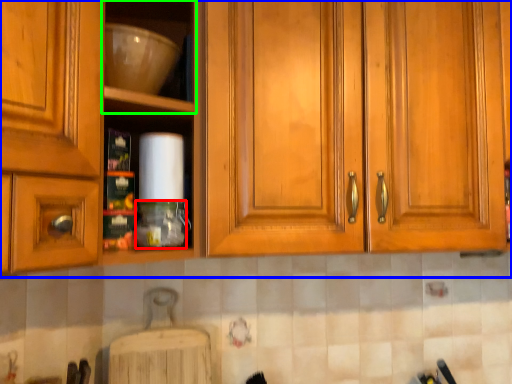
Question: Which object is the farthest from bottle (highlighted by a red box)? Choose among these: cabinetry (highlighted by a blue box) or shelf (highlighted by a green box).

Choices:
 (A) cabinetry
 (B) shelf

Answer: (B)